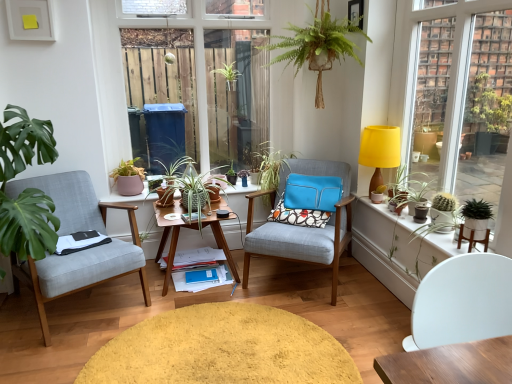
Question: Would you say patterned fabric pillow at center is outside green leafy plants at upper left?

Choices:
 (A) yes
 (B) no

Answer: (A)

Question: Can you confirm if patterned fabric pillow at center is positioned to the left of green leafy plants at upper left?

Choices:
 (A) yes
 (B) no

Answer: (B)

Question: Is patterned fabric pillow at center aimed at green leafy plants at upper left?

Choices:
 (A) no
 (B) yes

Answer: (A)

Question: Is the position of patterned fabric pillow at center less distant than that of green leafy plants at upper left?

Choices:
 (A) yes
 (B) no

Answer: (B)

Question: Considering the relative positions of patterned fabric pillow at center and green leafy plants at upper left in the image provided, is patterned fabric pillow at center to the right of green leafy plants at upper left from the viewer's perspective?

Choices:
 (A) yes
 (B) no

Answer: (A)

Question: Is green leafy plants at upper left at the back of patterned fabric pillow at center?

Choices:
 (A) yes
 (B) no

Answer: (B)

Question: Is matte black coffee cup at center located outside light gray fabric chair at left, positioned as the second chair in front-to-back order?

Choices:
 (A) yes
 (B) no

Answer: (A)

Question: Can you confirm if matte black coffee cup at center is smaller than light gray fabric chair at left, positioned as the second chair in front-to-back order?

Choices:
 (A) yes
 (B) no

Answer: (A)

Question: Can you confirm if matte black coffee cup at center is positioned to the right of light gray fabric chair at left, which is counted as the third chair, starting from the right?

Choices:
 (A) no
 (B) yes

Answer: (B)

Question: From the image's perspective, is matte black coffee cup at center over light gray fabric chair at left, which is the 1th chair from left to right?

Choices:
 (A) no
 (B) yes

Answer: (B)

Question: Is matte black coffee cup at center closer to camera compared to light gray fabric chair at left, placed as the second chair when sorted from back to front?

Choices:
 (A) no
 (B) yes

Answer: (A)

Question: Does matte black coffee cup at center have a lesser width compared to light gray fabric chair at left, positioned as the second chair in front-to-back order?

Choices:
 (A) yes
 (B) no

Answer: (A)

Question: Does yellow fabric lampshade at upper right have a larger size compared to green matte cactus at right?

Choices:
 (A) yes
 (B) no

Answer: (B)